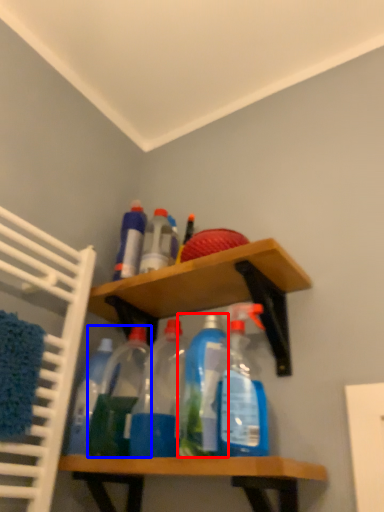
Question: Which object appears farthest to the camera in this image, bottle (highlighted by a red box) or bottle (highlighted by a blue box)?

Choices:
 (A) bottle
 (B) bottle

Answer: (B)